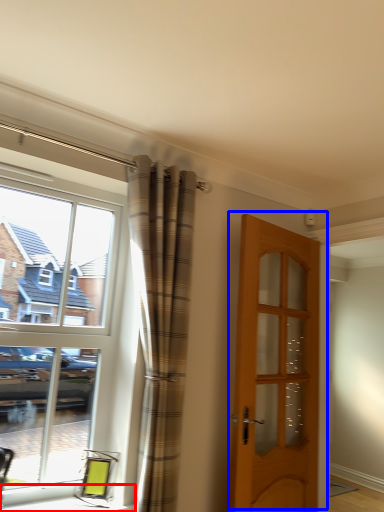
Question: Among these objects, which one is nearest to the camera, window sill (highlighted by a red box) or door (highlighted by a blue box)?

Choices:
 (A) window sill
 (B) door

Answer: (A)